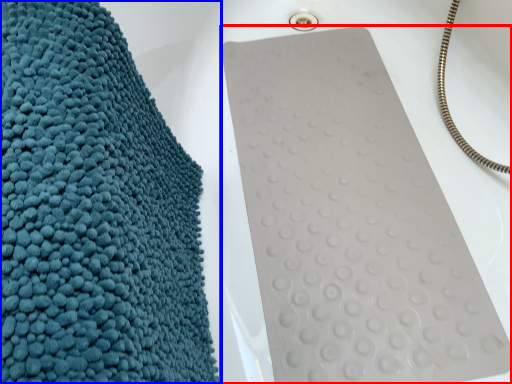
Question: Which object appears farthest to the camera in this image, bath towel (highlighted by a red box) or towel (highlighted by a blue box)?

Choices:
 (A) bath towel
 (B) towel

Answer: (A)